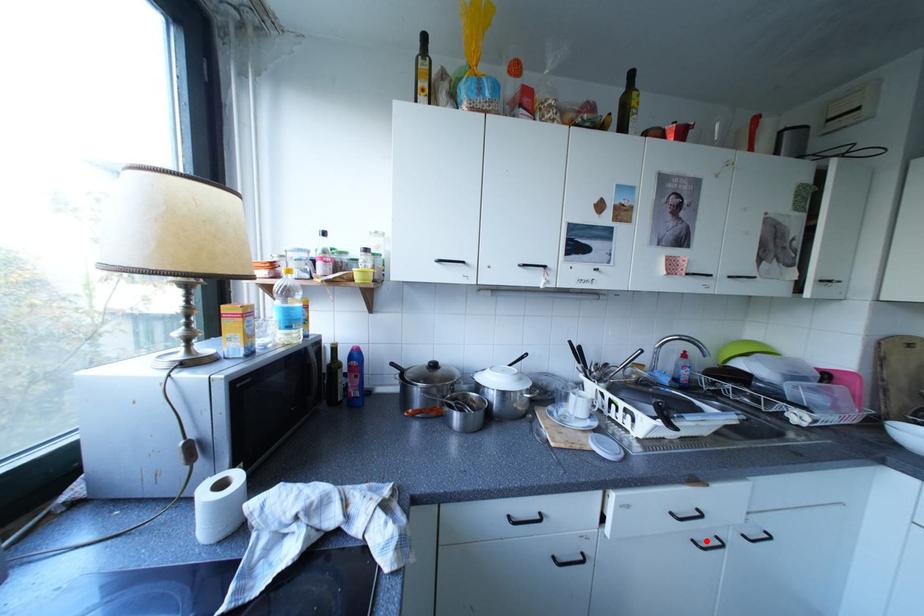
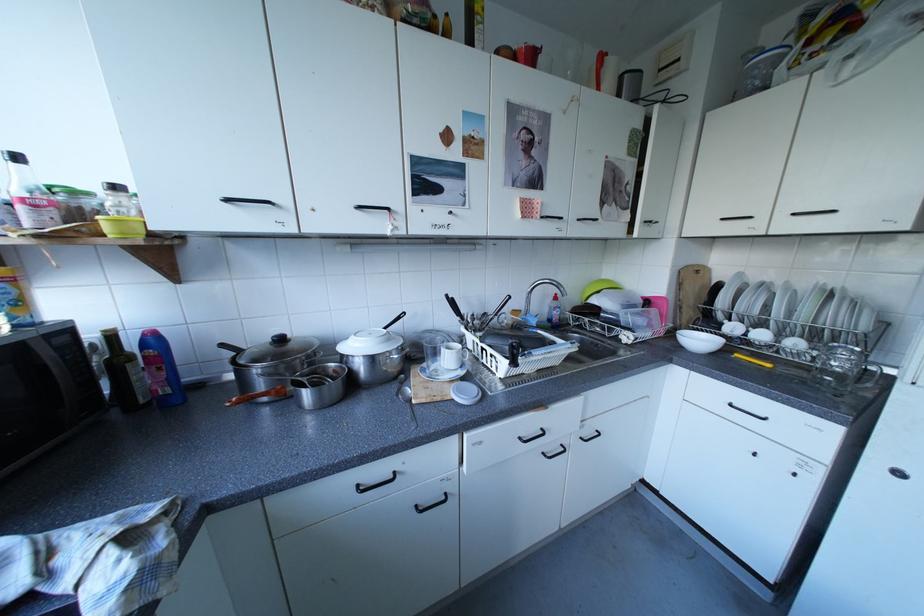
Where in the second image is the point corresponding to the highlighted location from the first image?

(555, 454)